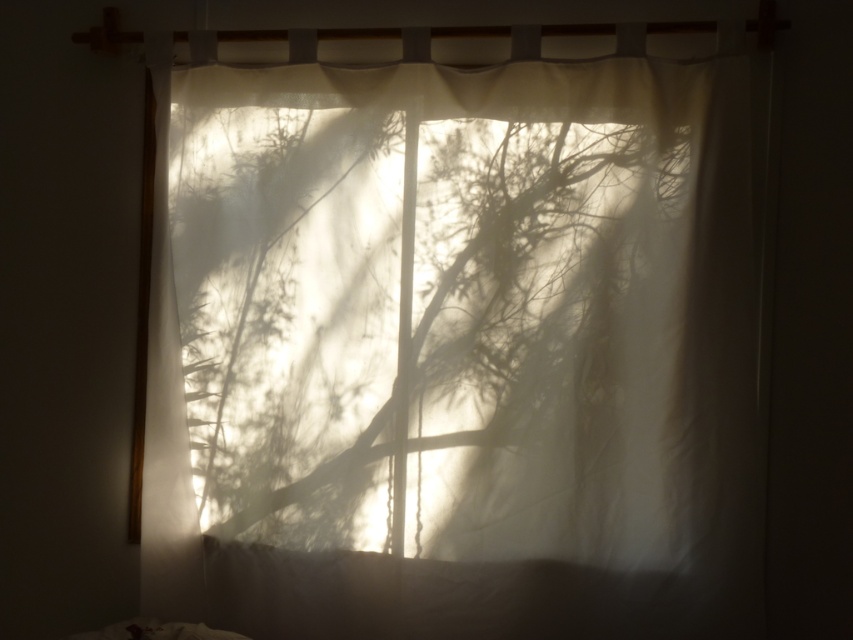
You are standing in a room with a translucent white curtain at center. If you want to find the exact middle point of the curtain, where should you look?

The exact middle point of the translucent white curtain at center is located at coordinates point (454, 333).

You are trying to determine the visibility of the white soft pillow at lower center from the front of the room. Since the translucent white curtain at center is blocking the view, can you see the pillow through the curtain?

The translucent white curtain at center is in front of the white soft pillow at lower center, so the curtain would block the view of the pillow from the front of the room.

You are arranging a living room and want to place a decorative item on top of the white soft pillow at lower center. The decorative item is 1.2 meters tall. Will the translucent white curtain at center block the view of the decorative item from the front?

The translucent white curtain at center is taller than the white soft pillow at lower center, so the curtain will block the view of the decorative item placed on top of the white soft pillow at lower center from the front.